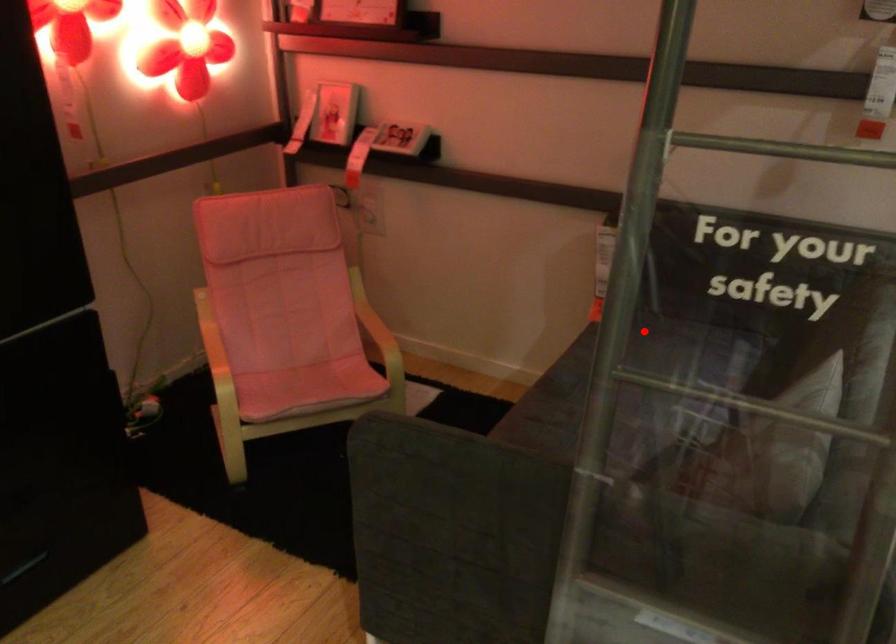
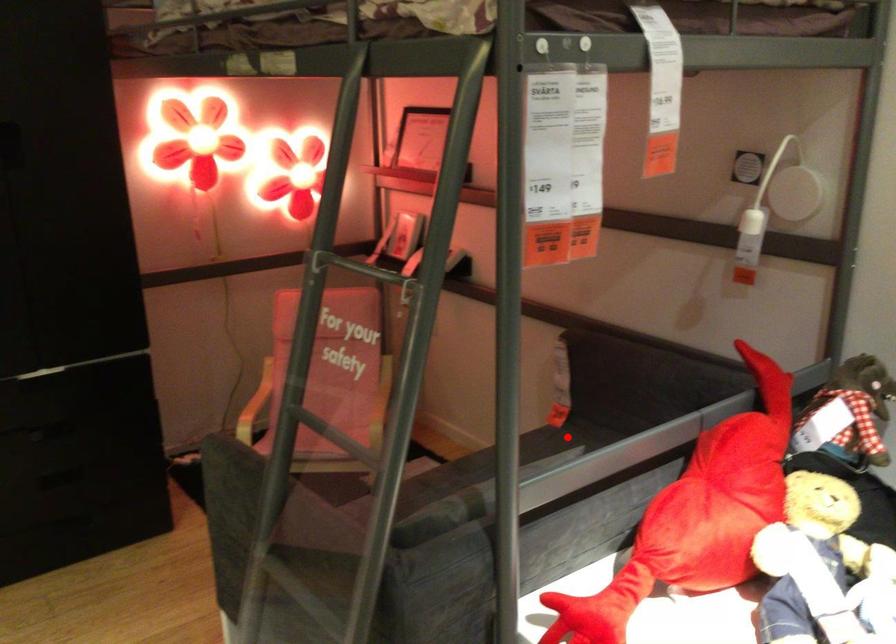
I am providing you with two images of the same scene from different viewpoints. A red point is marked on the first image and another point is marked on the second image. Is the red point in image1 aligned with the point shown in image2?

Yes